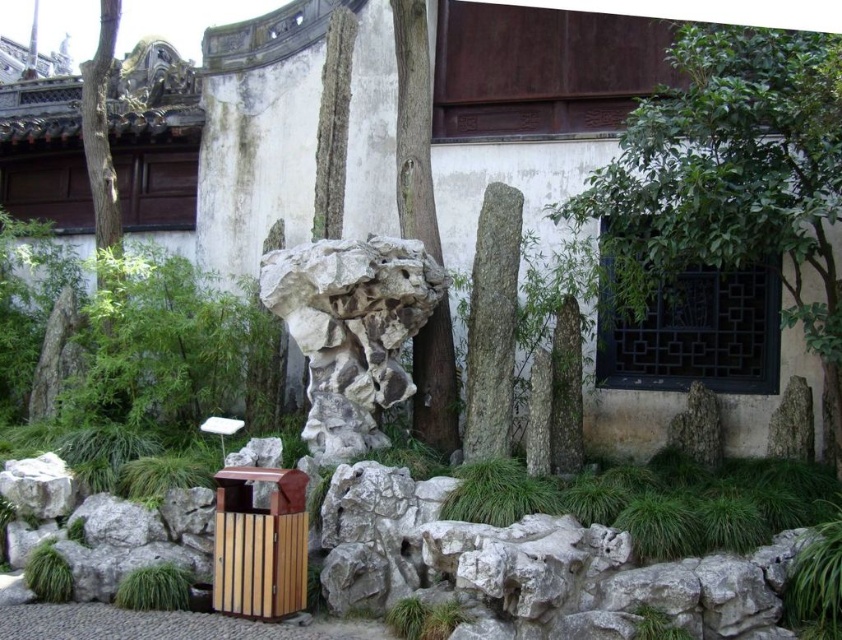
You are standing in the garden and want to take a photo of both the green leafy tree at center and the white stone rock at center. Which object should you position to your left side to include both in the frame?

To include both the green leafy tree at center and the white stone rock at center in the frame, position the white stone rock at center to your left side since the green leafy tree at center is to the right of it.

You are a gardener planning to install a new sprinkler system in the garden. The sprinkler has a maximum range of 8 meters. If you position the sprinkler at the smooth brown tree trunk at center, will it be able to water the green leafy tree at center?

The green leafy tree at center is 8.97 meters away from the smooth brown tree trunk at center. Since the sprinkler has a maximum range of 8 meters, it cannot reach the green leafy tree at center from that position.

You are an architect designing a garden path that must pass between the green leafy tree at center and the smooth brown tree trunk at center. The path needs to be at least 1.2 meters wide to accommodate visitors. Can the space between them accommodate this width?

The green leafy tree at center is wider than the smooth brown tree trunk at center. However, the description only provides information about their widths, not the distance between them. Without knowing the actual spacing between the two trees, it is impossible to determine if the path will be wide enough. Additional measurements of the gap between them are required.